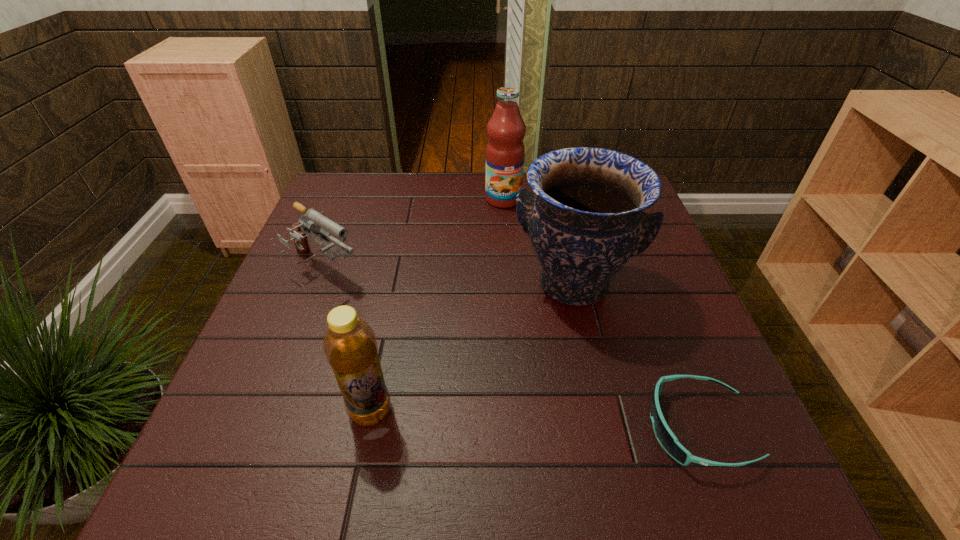
At what (x,y) coordinates should I click in order to perform the action: click on free spot on the desktop that is between the second object from left to right and the shortest object and is positioned on the front label of the fruit juice. Please return your answer as a coordinate pair (x, y). Looking at the image, I should click on (549, 420).

Where is `vacant space on the desktop that is between the bottle and the shortest object and is positioned at the barrel end of the leftmost object`? This screenshot has width=960, height=540. vacant space on the desktop that is between the bottle and the shortest object and is positioned at the barrel end of the leftmost object is located at coordinates (545, 420).

I want to click on vacant space on the desktop that is between the bottle and the sunglasses and is positioned on the front handle of the pottery, so (560, 421).